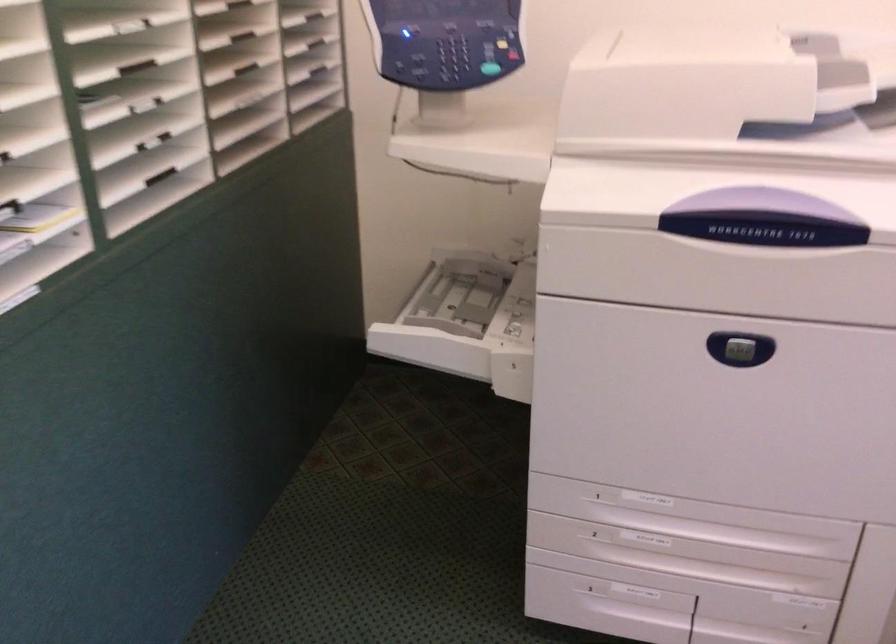
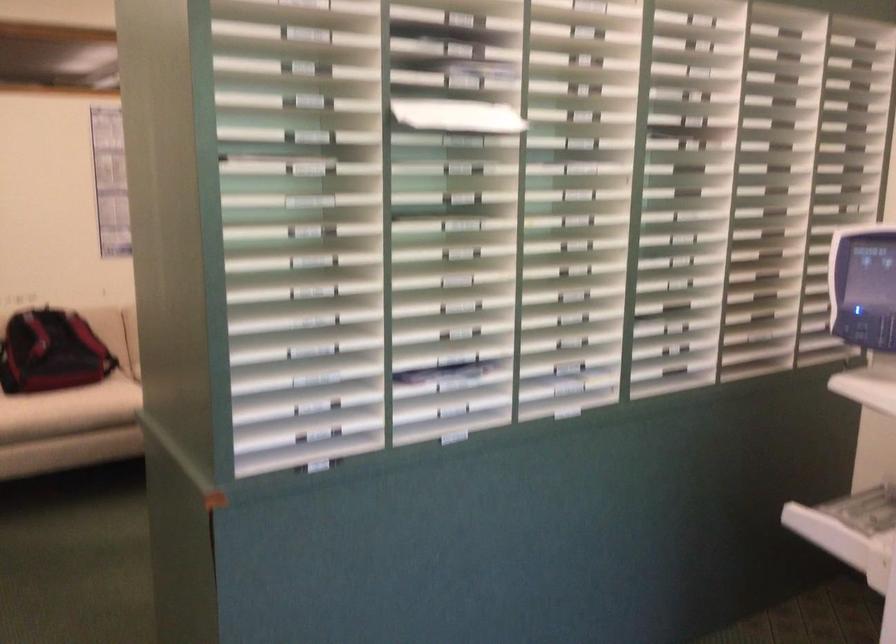
Question: Based on the continuous images, in which direction is the camera rotating? Reply with the corresponding letter.

Choices:
 (A) Left
 (B) Right
 (C) Up
 (D) Down

Answer: (A)